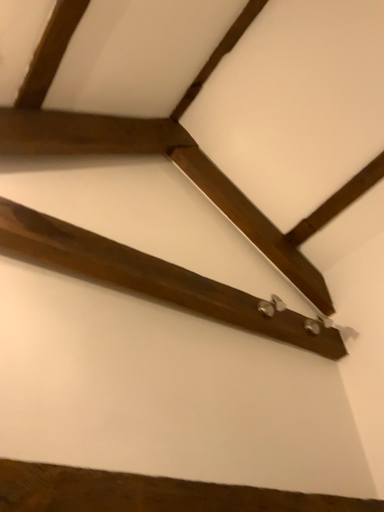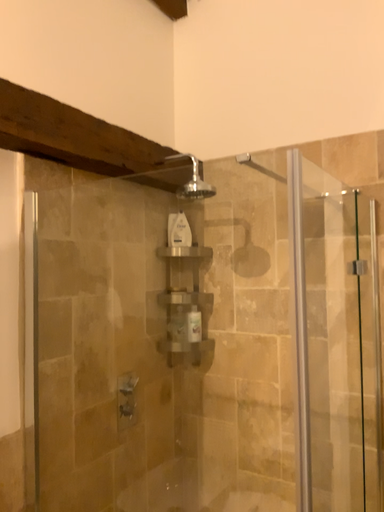
Question: Which way did the camera rotate in the video?

Choices:
 (A) rotated right
 (B) rotated left

Answer: (A)